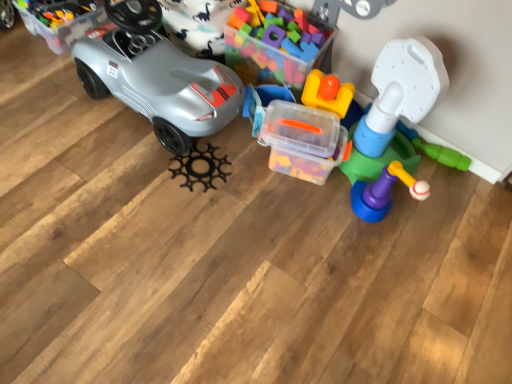
Describe the element at coordinates (276, 44) in the screenshot. I see `translucent plastic blocks at center, acting as the third toy starting from the left` at that location.

You are a GUI agent. You are given a task and a screenshot of the screen. Output one action in this format:
    pyautogui.click(x=<x>, y=<y>)
    Task: Click on the translucent plastic blocks at center, acting as the third toy starting from the left
    This screenshot has width=512, height=384.
    Given the screenshot: What is the action you would take?
    click(x=276, y=44)

The width and height of the screenshot is (512, 384). Describe the element at coordinates (262, 103) in the screenshot. I see `translucent plastic container at center, the third toy viewed from the right` at that location.

Describe the element at coordinates (393, 120) in the screenshot. The height and width of the screenshot is (384, 512). I see `translucent plastic tower at right, the first toy from the right` at that location.

Find the location of `clear plastic storage box at upper left`. clear plastic storage box at upper left is located at coordinates (62, 28).

Where is `translucent plastic blocks at center, acting as the third toy starting from the left`? This screenshot has height=384, width=512. translucent plastic blocks at center, acting as the third toy starting from the left is located at coordinates (276, 44).

Is clear plastic storage box at upper left turned away from translucent plastic blocks at center, acting as the third toy starting from the left?

clear plastic storage box at upper left is not turned away from translucent plastic blocks at center, acting as the third toy starting from the left.

From the image's perspective, between clear plastic storage box at upper left and translucent plastic blocks at center, which is counted as the 2th toy, starting from the right, which one is located above?

clear plastic storage box at upper left is shown above in the image.

Is translucent plastic blocks at center, acting as the third toy starting from the left, located within clear plastic storage box at upper left?

No, translucent plastic blocks at center, acting as the third toy starting from the left, is not a part of clear plastic storage box at upper left.

Find the location of a particular element. Image resolution: width=512 pixels, height=384 pixels. car on the left of black matte gear at center, which is counted as the first toy, starting from the left is located at coordinates (157, 76).

Considering the relative sizes of black matte gear at center, positioned as the fourth toy in right-to-left order, and matte gray car at left in the image provided, is black matte gear at center, positioned as the fourth toy in right-to-left order, shorter than matte gray car at left?

Yes.

Is black matte gear at center, which is counted as the first toy, starting from the left, in contact with matte gray car at left?

black matte gear at center, which is counted as the first toy, starting from the left, and matte gray car at left are not in contact.

Does black matte gear at center, positioned as the fourth toy in right-to-left order, have a greater width compared to matte gray car at left?

No.

Does matte gray car at left have a lesser height compared to black matte gear at center, positioned as the fourth toy in right-to-left order?

In fact, matte gray car at left may be taller than black matte gear at center, positioned as the fourth toy in right-to-left order.

Between matte gray car at left and black matte gear at center, positioned as the fourth toy in right-to-left order, which one has larger width?

With larger width is matte gray car at left.

Is matte gray car at left oriented away from black matte gear at center, positioned as the fourth toy in right-to-left order?

That's not correct — matte gray car at left is not looking away from black matte gear at center, positioned as the fourth toy in right-to-left order.

From the image's perspective, which object appears higher, matte gray car at left or black matte gear at center, positioned as the fourth toy in right-to-left order?

matte gray car at left.

Is translucent plastic container at center, the third toy viewed from the right, oriented away from translucent plastic tower at right, the first toy from the right?

translucent plastic container at center, the third toy viewed from the right, is not turned away from translucent plastic tower at right, the first toy from the right.

Who is bigger, translucent plastic container at center, the second toy in the left-to-right sequence, or translucent plastic tower at right, placed as the 4th toy when sorted from left to right?

translucent plastic tower at right, placed as the 4th toy when sorted from left to right, is bigger.

From the translucent plastic tower at right, the first toy from the right, count 3rd toys backward and point to it. Please provide its 2D coordinates.

[(262, 103)]

From their relative heights in the image, would you say translucent plastic container at center, the third toy viewed from the right, is taller or shorter than translucent plastic tower at right, placed as the 4th toy when sorted from left to right?

translucent plastic container at center, the third toy viewed from the right, is shorter than translucent plastic tower at right, placed as the 4th toy when sorted from left to right.

Is translucent plastic tower at right, the first toy from the right, oriented towards translucent plastic blocks at center, which is counted as the 2th toy, starting from the right?

No, translucent plastic tower at right, the first toy from the right, does not turn towards translucent plastic blocks at center, which is counted as the 2th toy, starting from the right.

Is point (394, 75) closer to viewer compared to point (228, 23)?

That is True.

Considering the relative sizes of translucent plastic tower at right, the first toy from the right, and translucent plastic blocks at center, which is counted as the 2th toy, starting from the right, in the image provided, is translucent plastic tower at right, the first toy from the right, wider than translucent plastic blocks at center, which is counted as the 2th toy, starting from the right,?

Indeed, translucent plastic tower at right, the first toy from the right, has a greater width compared to translucent plastic blocks at center, which is counted as the 2th toy, starting from the right.

From a real-world perspective, is translucent plastic tower at right, the first toy from the right, positioned above or below translucent plastic blocks at center, acting as the third toy starting from the left?

In terms of real-world spatial position, translucent plastic tower at right, the first toy from the right, is above translucent plastic blocks at center, acting as the third toy starting from the left.

Considering the sizes of objects clear plastic storage box at upper left and matte gray car at left in the image provided, who is bigger, clear plastic storage box at upper left or matte gray car at left?

matte gray car at left is bigger.

Which is behind, point (89, 17) or point (87, 38)?

The point (89, 17) is farther.

Based on the photo, relative to matte gray car at left, is clear plastic storage box at upper left in front or behind?

In the image, clear plastic storage box at upper left appears behind matte gray car at left.

Which of these two, clear plastic storage box at upper left or matte gray car at left, is wider?

Wider between the two is clear plastic storage box at upper left.

From the image's perspective, is translucent plastic blocks at center, which is counted as the 2th toy, starting from the right, located above or below black matte gear at center, which is counted as the first toy, starting from the left?

From the image's perspective, translucent plastic blocks at center, which is counted as the 2th toy, starting from the right, appears above black matte gear at center, which is counted as the first toy, starting from the left.

Is translucent plastic blocks at center, which is counted as the 2th toy, starting from the right, in contact with black matte gear at center, which is counted as the first toy, starting from the left?

No, translucent plastic blocks at center, which is counted as the 2th toy, starting from the right, is not making contact with black matte gear at center, which is counted as the first toy, starting from the left.

Which object is further away from the camera taking this photo, translucent plastic blocks at center, which is counted as the 2th toy, starting from the right, or black matte gear at center, which is counted as the first toy, starting from the left?

black matte gear at center, which is counted as the first toy, starting from the left, is more distant.

Between translucent plastic blocks at center, acting as the third toy starting from the left, and black matte gear at center, which is counted as the first toy, starting from the left, which one has smaller width?

black matte gear at center, which is counted as the first toy, starting from the left.

At what (x,y) coordinates should I click in order to perform the action: click on the 1st toy located above the clear plastic storage box at upper left (from a real-world perspective). Please return your answer as a coordinate pair (x, y). The height and width of the screenshot is (384, 512). Looking at the image, I should click on (276, 44).

Where is `toy that is the 1st object to the right of the matte gray car at left, starting at the anchor`? This screenshot has width=512, height=384. toy that is the 1st object to the right of the matte gray car at left, starting at the anchor is located at coordinates (200, 167).

Looking at the image, which one is located further to black matte gear at center, positioned as the fourth toy in right-to-left order, translucent plastic container at center, the third toy viewed from the right, or translucent plastic blocks at center, which is counted as the 2th toy, starting from the right?

translucent plastic blocks at center, which is counted as the 2th toy, starting from the right, is positioned further to the anchor black matte gear at center, positioned as the fourth toy in right-to-left order.

From the image, which object appears to be farther from matte gray car at left, clear plastic storage box at upper left or translucent plastic container at center, the third toy viewed from the right?

clear plastic storage box at upper left is further to matte gray car at left.

Considering their positions, is clear plastic storage box at upper left positioned further to translucent plastic container at center, the second toy in the left-to-right sequence, than black matte gear at center, which is counted as the first toy, starting from the left?

Based on the image, clear plastic storage box at upper left appears to be further to translucent plastic container at center, the second toy in the left-to-right sequence.

Which object lies nearer to the anchor point translucent plastic tower at right, the first toy from the right, clear plastic storage box at upper left or matte gray car at left?

matte gray car at left.

Based on their spatial positions, is black matte gear at center, which is counted as the first toy, starting from the left, or translucent plastic tower at right, the first toy from the right, further from matte gray car at left?

translucent plastic tower at right, the first toy from the right.

Consider the image. Looking at the image, which one is located closer to matte gray car at left, translucent plastic blocks at center, acting as the third toy starting from the left, or black matte gear at center, positioned as the fourth toy in right-to-left order?

Based on the image, black matte gear at center, positioned as the fourth toy in right-to-left order, appears to be nearer to matte gray car at left.

From the picture: From the image, which object appears to be nearer to translucent plastic blocks at center, acting as the third toy starting from the left, matte gray car at left or clear plastic storage box at upper left?

matte gray car at left is positioned closer to the anchor translucent plastic blocks at center, acting as the third toy starting from the left.

Considering their positions, is translucent plastic tower at right, the first toy from the right, positioned further to clear plastic storage box at upper left than black matte gear at center, positioned as the fourth toy in right-to-left order?

Based on the image, translucent plastic tower at right, the first toy from the right, appears to be further to clear plastic storage box at upper left.

In order to click on toy between clear plastic storage box at upper left and translucent plastic container at center, the second toy in the left-to-right sequence, in the horizontal direction in this screenshot , I will do `click(200, 167)`.

Image resolution: width=512 pixels, height=384 pixels. I want to click on car between translucent plastic blocks at center, acting as the third toy starting from the left, and black matte gear at center, positioned as the fourth toy in right-to-left order, in the up-down direction, so click(157, 76).

You are a GUI agent. You are given a task and a screenshot of the screen. Output one action in this format:
    pyautogui.click(x=<x>, y=<y>)
    Task: Click on the car between clear plastic storage box at upper left and translucent plastic blocks at center, which is counted as the 2th toy, starting from the right
    
    Given the screenshot: What is the action you would take?
    pyautogui.click(x=157, y=76)

This screenshot has height=384, width=512. Identify the location of car between clear plastic storage box at upper left and translucent plastic tower at right, the first toy from the right, in the horizontal direction. (157, 76).